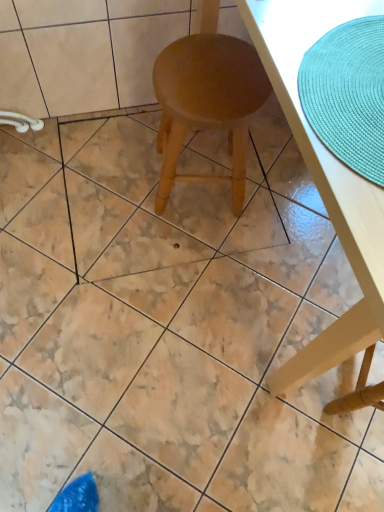
Question: Is wooden table at center inside the boundaries of light brown wood stool at center, or outside?

Choices:
 (A) outside
 (B) inside

Answer: (A)

Question: From a real-world perspective, is wooden table at center physically located above or below light brown wood stool at center?

Choices:
 (A) above
 (B) below

Answer: (A)

Question: Which object is positioned farthest from the wooden table at center?

Choices:
 (A) teal woven placemat at upper right
 (B) light brown wood stool at center

Answer: (B)

Question: Considering the real-world distances, which object is farthest from the wooden table at center?

Choices:
 (A) teal woven placemat at upper right
 (B) light brown wood stool at center

Answer: (B)